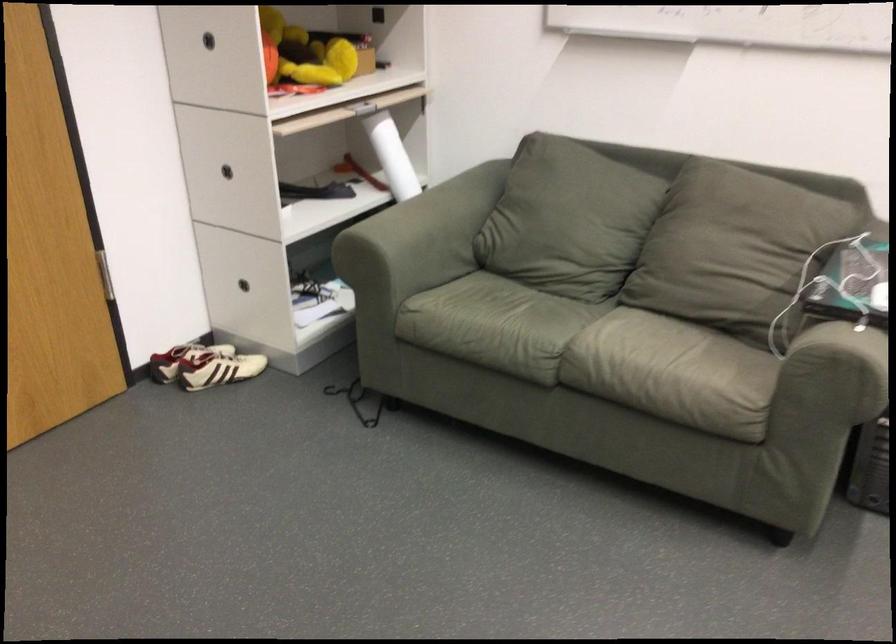
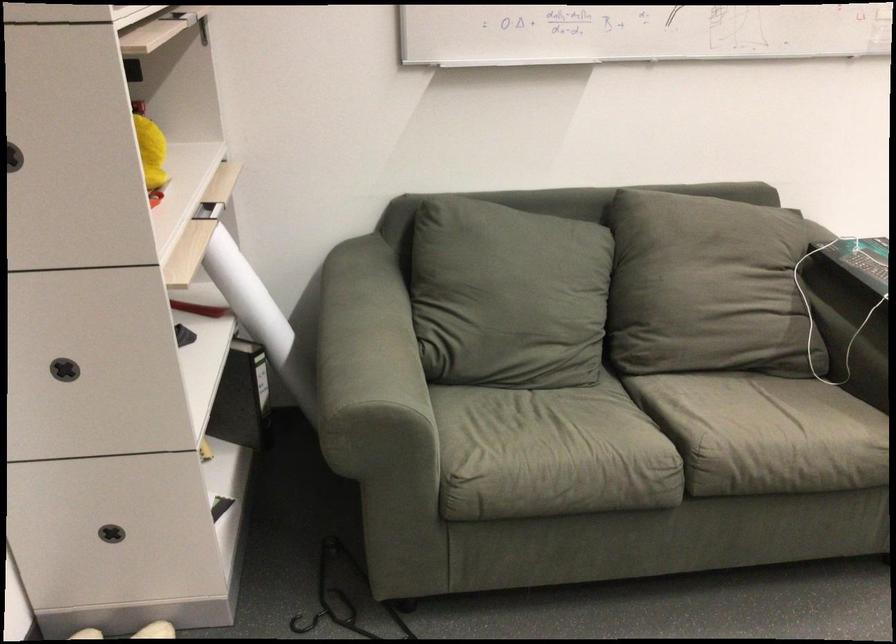
In the second image, find the point that corresponds to the point at 703,243 in the first image.

(707, 287)